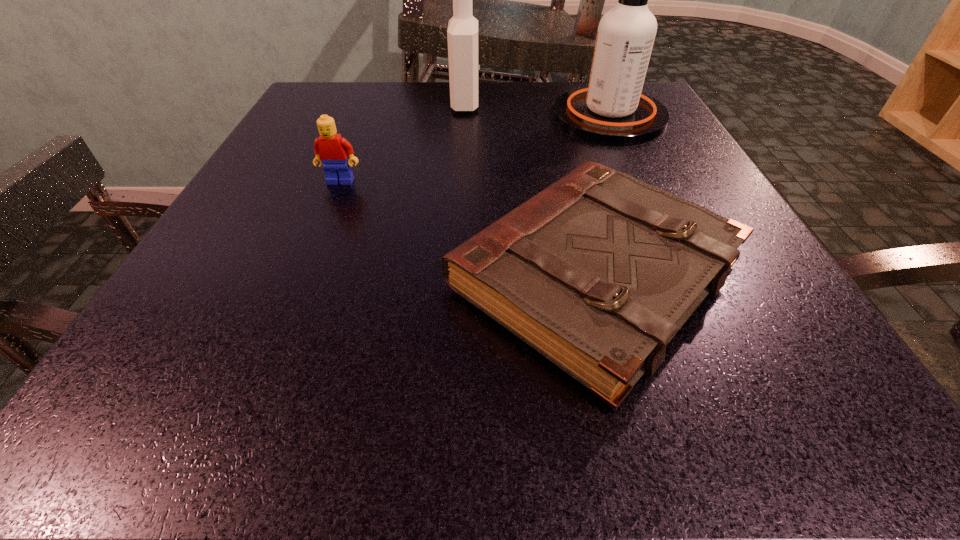
Locate which object is the second closest to the hardback book. Please provide its 2D coordinates. Your answer should be formatted as a tuple, i.e. [(x, y)], where the tuple contains the x and y coordinates of a point satisfying the conditions above.

[(612, 109)]

Locate an element on the screen. This screenshot has width=960, height=540. the closest object to the nearest object is located at coordinates (332, 150).

Locate an element on the screen. The width and height of the screenshot is (960, 540). vacant position in the image that satisfies the following two spatial constraints: 1. on the front label of the shortest object; 2. on the left side of the left cleansing agent is located at coordinates (458, 276).

Identify the location of free space in the image that satisfies the following two spatial constraints: 1. on the face of the Lego; 2. on the left side of the shortest object. coord(302,276).

This screenshot has width=960, height=540. I want to click on vacant space that satisfies the following two spatial constraints: 1. on the front label of the left cleansing agent; 2. on the back side of the right cleansing agent, so click(466, 116).

Where is `free region that satisfies the following two spatial constraints: 1. on the front label of the nearest object; 2. on the right side of the left cleansing agent`? The image size is (960, 540). free region that satisfies the following two spatial constraints: 1. on the front label of the nearest object; 2. on the right side of the left cleansing agent is located at coordinates (458, 276).

Identify the location of free point that satisfies the following two spatial constraints: 1. on the front label of the left cleansing agent; 2. on the back side of the right cleansing agent. The image size is (960, 540). (466, 116).

At what (x,y) coordinates should I click in order to perform the action: click on free space in the image that satisfies the following two spatial constraints: 1. on the face of the third tallest object; 2. on the left side of the nearest object. Please return your answer as a coordinate pair (x, y). The width and height of the screenshot is (960, 540). Looking at the image, I should click on (302, 276).

Find the location of `blank space that satisfies the following two spatial constraints: 1. on the front label of the left cleansing agent; 2. on the right side of the shortest object`. blank space that satisfies the following two spatial constraints: 1. on the front label of the left cleansing agent; 2. on the right side of the shortest object is located at coordinates (458, 276).